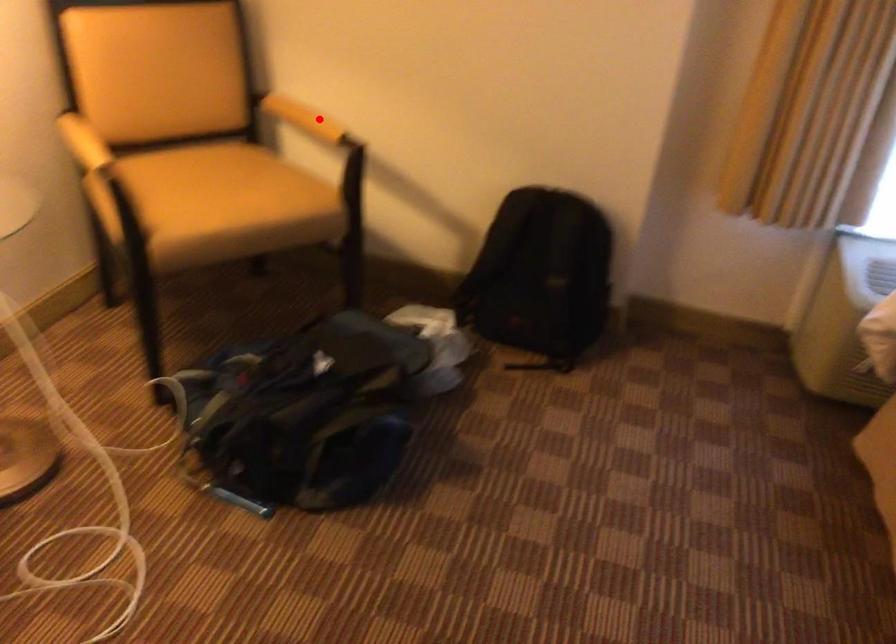
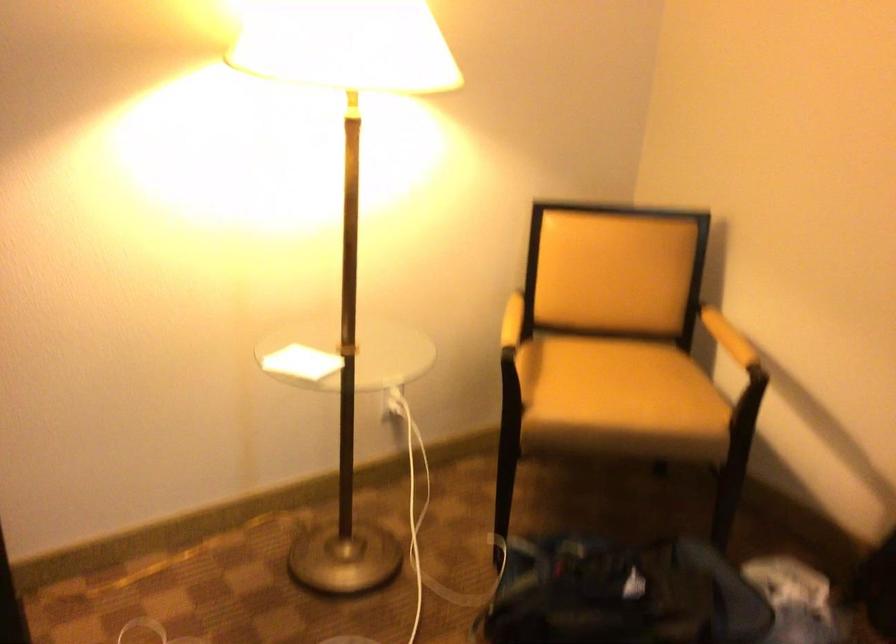
Find the pixel in the second image that matches the highlighted location in the first image.

(728, 337)